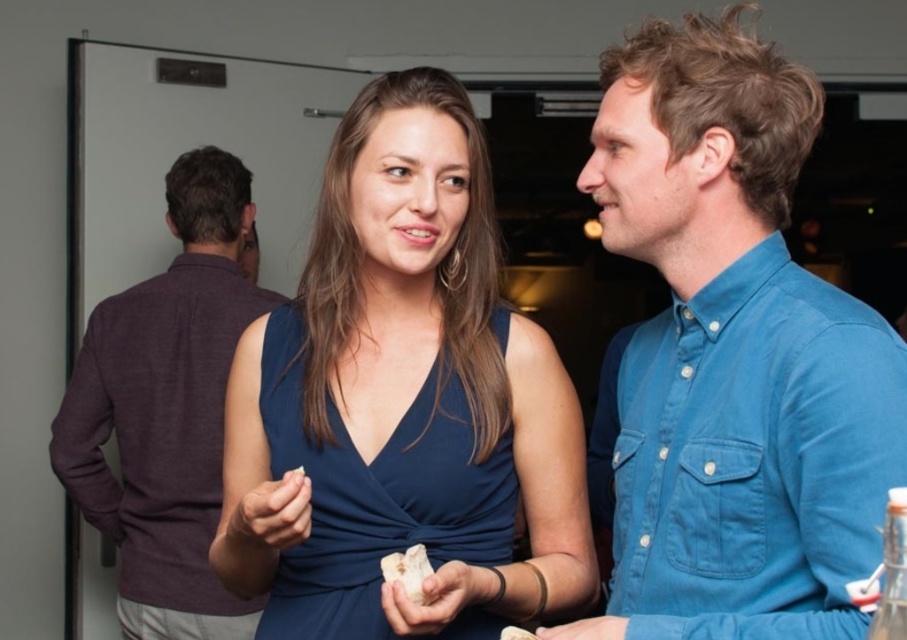
Question: Among these points, which one is farthest from the camera?

Choices:
 (A) (381, 534)
 (B) (96, 340)

Answer: (B)

Question: Is blue cotton shirt at upper right closer to camera compared to dark purple sweater at left?

Choices:
 (A) yes
 (B) no

Answer: (A)

Question: Is blue cotton shirt at upper right closer to the viewer compared to dark purple sweater at left?

Choices:
 (A) yes
 (B) no

Answer: (A)

Question: Which point appears closest to the camera in this image?

Choices:
 (A) (504, 508)
 (B) (382, 556)

Answer: (B)

Question: Which point is farther from the camera taking this photo?

Choices:
 (A) (155, 385)
 (B) (413, 602)

Answer: (A)

Question: Is matte blue dress at center bigger than navy satin dress at center?

Choices:
 (A) yes
 (B) no

Answer: (A)